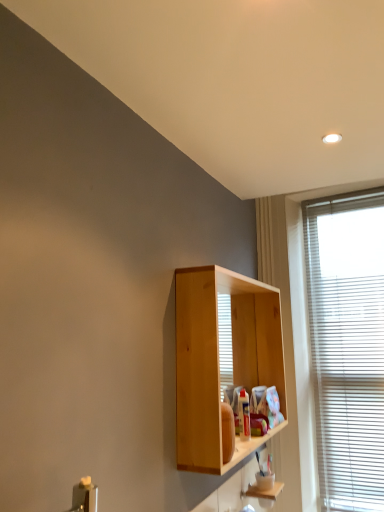
The width and height of the screenshot is (384, 512). I want to click on wooden cabinet at lower right, so click(264, 484).

This screenshot has height=512, width=384. What do you see at coordinates (263, 490) in the screenshot?
I see `wooden shelf at lower center` at bounding box center [263, 490].

What do you see at coordinates (219, 359) in the screenshot?
I see `natural wood cabinet at center` at bounding box center [219, 359].

This screenshot has height=512, width=384. Find the location of `wooden cabinet at lower right`. wooden cabinet at lower right is located at coordinates (264, 484).

Looking at this image, from the image's perspective, which one is positioned lower, wooden cabinet at lower right or natural wood cabinet at center?

wooden cabinet at lower right, from the image's perspective.

Looking at this image, is wooden cabinet at lower right next to natural wood cabinet at center?

wooden cabinet at lower right and natural wood cabinet at center are clearly separated.

From a real-world perspective, is wooden cabinet at lower right above or below natural wood cabinet at center?

From a real-world perspective, wooden cabinet at lower right is physically below natural wood cabinet at center.

How different are the orientations of wooden cabinet at lower right and natural wood cabinet at center in degrees?

wooden cabinet at lower right and natural wood cabinet at center are facing 2.85 degrees away from each other.

Is natural wood cabinet at center inside the boundaries of wooden cabinet at lower right, or outside?

natural wood cabinet at center is outside wooden cabinet at lower right.

From the picture: Is natural wood cabinet at center in contact with wooden cabinet at lower right?

They are not placed beside each other.

Based on the photo, how different are the orientations of natural wood cabinet at center and wooden cabinet at lower right in degrees?

The angle between the facing direction of natural wood cabinet at center and the facing direction of wooden cabinet at lower right is 2.85 degrees.

Is natural wood cabinet at center positioned with its back to wooden cabinet at lower right?

No, wooden cabinet at lower right is not at the back of natural wood cabinet at center.

Considering the sizes of objects white blinds at right and wooden cabinet at lower right in the image provided, who is smaller, white blinds at right or wooden cabinet at lower right?

wooden cabinet at lower right.

Could you tell me if white blinds at right is turned towards wooden cabinet at lower right?

No, white blinds at right is not facing towards wooden cabinet at lower right.

In terms of width, does white blinds at right look wider or thinner when compared to wooden cabinet at lower right?

Clearly, white blinds at right has less width compared to wooden cabinet at lower right.

Is white blinds at right in contact with wooden cabinet at lower right?

white blinds at right is not next to wooden cabinet at lower right, and they're not touching.

Considering their positions, is white blinds at right located in front of or behind wooden shelf at lower center?

white blinds at right is behind wooden shelf at lower center.

Is point (329, 458) closer to camera compared to point (250, 495)?

No, (329, 458) is behind (250, 495).

Choose the correct answer: Is white blinds at right inside wooden shelf at lower center or outside it?

white blinds at right is outside wooden shelf at lower center.

Find the location of a particular element. window above the wooden shelf at lower center (from the image's perspective) is located at coordinates (347, 344).

Is white blinds at right at the back of wooden cabinet at lower right?

wooden cabinet at lower right is not turned away from white blinds at right.

Can you confirm if wooden cabinet at lower right is smaller than white blinds at right?

Yes.

Which object is wider, wooden cabinet at lower right or white blinds at right?

With larger width is wooden cabinet at lower right.

From the image's perspective, relative to white blinds at right, is wooden cabinet at lower right above or below?

wooden cabinet at lower right is situated lower than white blinds at right in the image.

Between wooden shelf at lower center and natural wood cabinet at center, which one has more height?

With more height is natural wood cabinet at center.

Considering the positions of objects wooden shelf at lower center and natural wood cabinet at center in the image provided, who is more to the left, wooden shelf at lower center or natural wood cabinet at center?

natural wood cabinet at center is more to the left.

What are the coordinates of `cabinetry lying in front of the wooden shelf at lower center` in the screenshot? It's located at (219, 359).

Does wooden shelf at lower center touch natural wood cabinet at center?

No, wooden shelf at lower center is not with natural wood cabinet at center.

Considering the relative sizes of wooden cabinet at lower right and wooden shelf at lower center in the image provided, is wooden cabinet at lower right bigger than wooden shelf at lower center?

Yes.

Considering the relative sizes of wooden cabinet at lower right and wooden shelf at lower center in the image provided, is wooden cabinet at lower right wider than wooden shelf at lower center?

Incorrect, the width of wooden cabinet at lower right does not surpass that of wooden shelf at lower center.

In terms of height, does wooden cabinet at lower right look taller or shorter compared to wooden shelf at lower center?

wooden cabinet at lower right is taller than wooden shelf at lower center.

From a real-world perspective, is wooden cabinet at lower right positioned above or below wooden shelf at lower center?

wooden cabinet at lower right is above wooden shelf at lower center.

Locate an element on the screen. cabinetry above the wooden cabinet at lower right (from a real-world perspective) is located at coordinates (219, 359).

In the image, there is a natural wood cabinet at center. Where is `cabinet below it (from the image's perspective)`? This screenshot has width=384, height=512. cabinet below it (from the image's perspective) is located at coordinates (264, 484).

Looking at the image, which one is located further to white blinds at right, wooden cabinet at lower right or natural wood cabinet at center?

wooden cabinet at lower right is further to white blinds at right.

Consider the image. Considering their positions, is white blinds at right positioned closer to wooden shelf at lower center than wooden cabinet at lower right?

Among the two, wooden cabinet at lower right is located nearer to wooden shelf at lower center.

Estimate the real-world distances between objects in this image. Which object is further from natural wood cabinet at center, wooden shelf at lower center or white blinds at right?

Among the two, wooden shelf at lower center is located further to natural wood cabinet at center.

From the image, which object appears to be farther from natural wood cabinet at center, wooden cabinet at lower right or wooden shelf at lower center?

wooden shelf at lower center is further to natural wood cabinet at center.

Which object lies nearer to the anchor point white blinds at right, wooden shelf at lower center or natural wood cabinet at center?

natural wood cabinet at center.

From the image, which object appears to be nearer to wooden shelf at lower center, natural wood cabinet at center or wooden cabinet at lower right?

wooden cabinet at lower right is closer to wooden shelf at lower center.

Looking at the image, which one is located further to white blinds at right, wooden cabinet at lower right or wooden shelf at lower center?

wooden shelf at lower center is positioned further to the anchor white blinds at right.

From the image, which object appears to be farther from white blinds at right, natural wood cabinet at center or wooden shelf at lower center?

wooden shelf at lower center.

Find the location of a particular element. cabinet between wooden shelf at lower center and white blinds at right is located at coordinates (264, 484).

Where is `cabinet between natural wood cabinet at center and wooden shelf at lower center in the vertical direction`? The image size is (384, 512). cabinet between natural wood cabinet at center and wooden shelf at lower center in the vertical direction is located at coordinates (264, 484).

Where is `shelf located between natural wood cabinet at center and white blinds at right in the depth direction`? The image size is (384, 512). shelf located between natural wood cabinet at center and white blinds at right in the depth direction is located at coordinates (263, 490).

Identify the location of cabinet between natural wood cabinet at center and white blinds at right along the z-axis. The height and width of the screenshot is (512, 384). (264, 484).